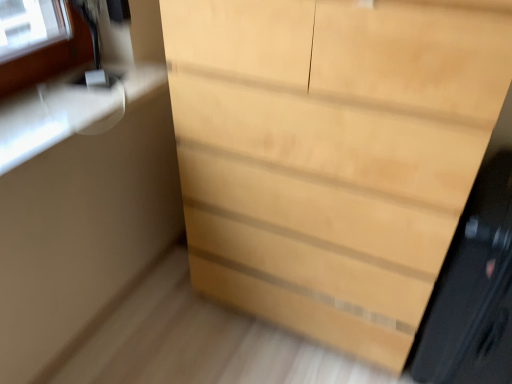
Question: Does black glossy screen door at right touch light wood chest of drawers at center?

Choices:
 (A) yes
 (B) no

Answer: (B)

Question: Can you confirm if black glossy screen door at right is wider than light wood chest of drawers at center?

Choices:
 (A) yes
 (B) no

Answer: (A)

Question: From the image's perspective, would you say black glossy screen door at right is positioned over light wood chest of drawers at center?

Choices:
 (A) yes
 (B) no

Answer: (B)

Question: Is black glossy screen door at right not near light wood chest of drawers at center?

Choices:
 (A) no
 (B) yes

Answer: (A)

Question: Considering the relative positions of black glossy screen door at right and light wood chest of drawers at center in the image provided, is black glossy screen door at right behind light wood chest of drawers at center?

Choices:
 (A) yes
 (B) no

Answer: (A)

Question: Considering the relative sizes of black glossy screen door at right and light wood chest of drawers at center in the image provided, is black glossy screen door at right thinner than light wood chest of drawers at center?

Choices:
 (A) no
 (B) yes

Answer: (A)

Question: Is light wood chest of drawers at center behind black glossy screen door at right?

Choices:
 (A) no
 (B) yes

Answer: (A)

Question: From the image's perspective, is light wood chest of drawers at center located beneath black glossy screen door at right?

Choices:
 (A) yes
 (B) no

Answer: (B)

Question: Considering the relative sizes of light wood chest of drawers at center and black glossy screen door at right in the image provided, is light wood chest of drawers at center bigger than black glossy screen door at right?

Choices:
 (A) no
 (B) yes

Answer: (B)

Question: Is light wood chest of drawers at center in front of black glossy screen door at right?

Choices:
 (A) yes
 (B) no

Answer: (A)

Question: From the image's perspective, is light wood chest of drawers at center over black glossy screen door at right?

Choices:
 (A) yes
 (B) no

Answer: (A)

Question: Is light wood chest of drawers at center aimed at black glossy screen door at right?

Choices:
 (A) yes
 (B) no

Answer: (B)

Question: In the image, is light wood chest of drawers at center on the left side or the right side of black glossy screen door at right?

Choices:
 (A) right
 (B) left

Answer: (B)